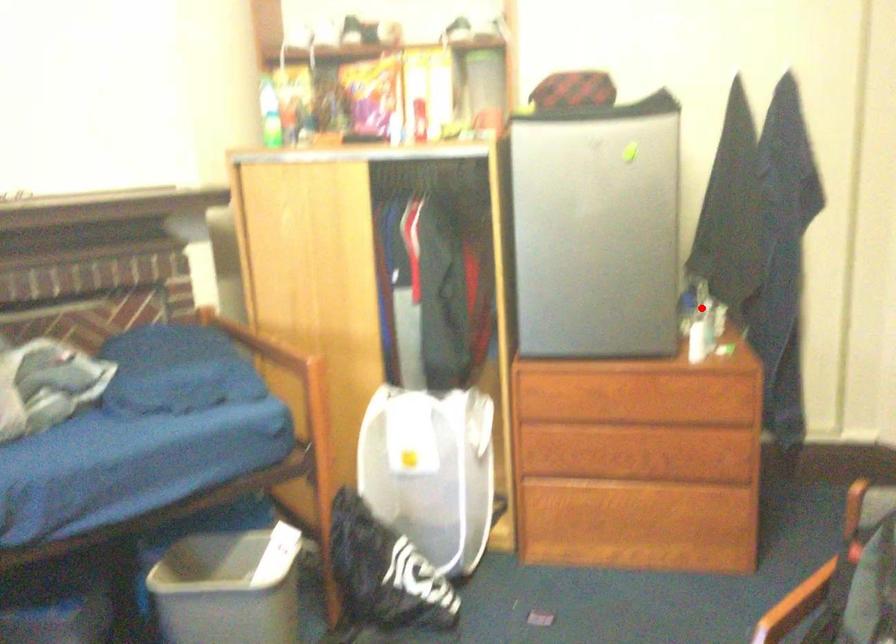
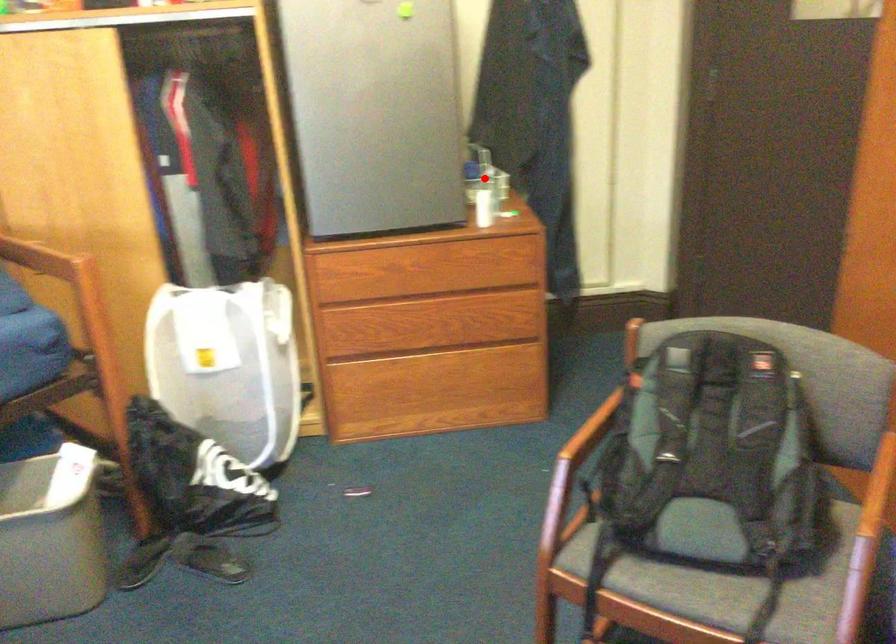
I am providing you with two images of the same scene from different viewpoints. A red point is marked on the first image and another point is marked on the second image. Do the highlighted points in image1 and image2 indicate the same real-world spot?

Yes